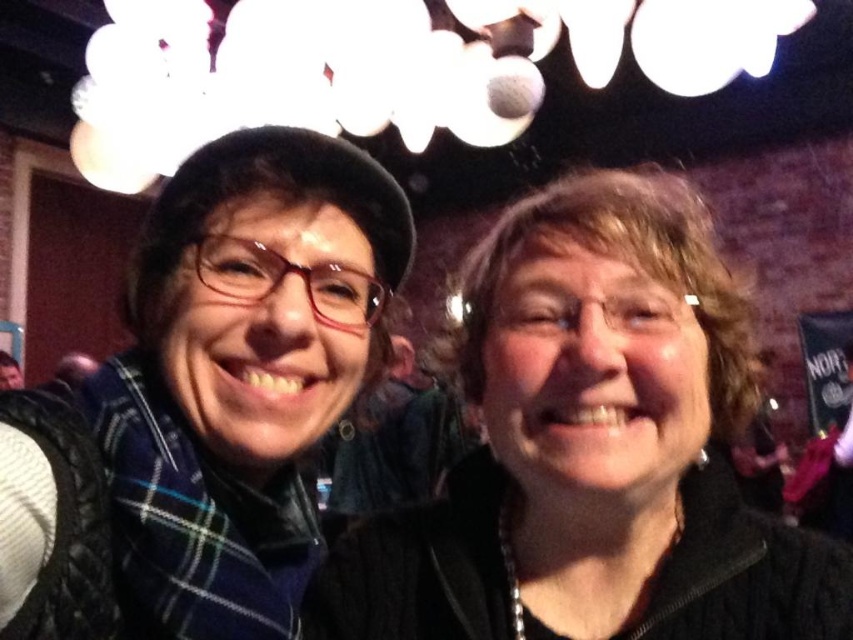
Question: Observing the image, what is the correct spatial positioning of black matte jacket at center in reference to plaid scarf at left?

Choices:
 (A) above
 (B) below

Answer: (B)

Question: Is black matte jacket at center wider than plaid scarf at left?

Choices:
 (A) no
 (B) yes

Answer: (B)

Question: Where is black matte jacket at center located in relation to plaid scarf at left in the image?

Choices:
 (A) above
 (B) below

Answer: (B)

Question: Which point is farther to the camera?

Choices:
 (A) (488, 481)
 (B) (195, 593)

Answer: (A)

Question: Which of the following is the farthest from the observer?

Choices:
 (A) (512, 401)
 (B) (364, 260)

Answer: (B)